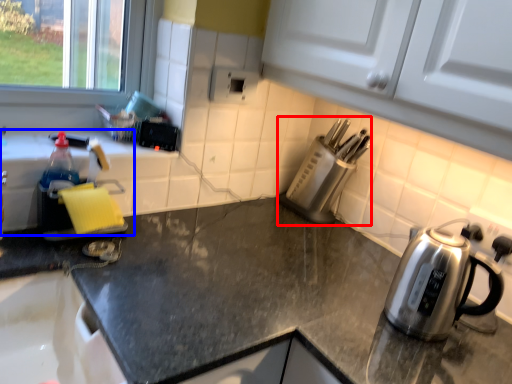
Question: Among these objects, which one is farthest to the camera, appliance (highlighted by a red box) or sink (highlighted by a blue box)?

Choices:
 (A) appliance
 (B) sink

Answer: (A)